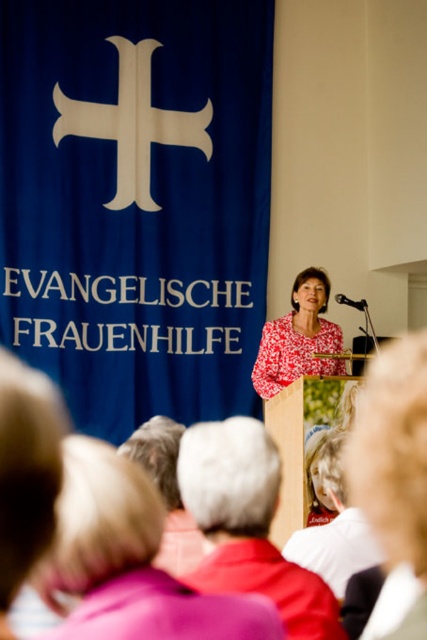
Between point (116, 157) and point (395, 540), which one is positioned in front?

Point (395, 540)

Between blue fabric banner at upper left and blonde hair at center, which one has more height?

blonde hair at center

In order to click on blue fabric banner at upper left in this screenshot , I will do `click(136, 202)`.

Image resolution: width=427 pixels, height=640 pixels. What are the coordinates of `blue fabric banner at upper left` in the screenshot? It's located at (136, 202).

Is point (257, 529) farther from camera compared to point (394, 380)?

Yes, it is.

Is white hair at center positioned in front of blonde hair at center?

No.

Is point (289, 609) positioned in front of point (391, 444)?

No.

Locate an element on the screen. The image size is (427, 640). white hair at center is located at coordinates (248, 524).

Can you confirm if blue fabric banner at upper left is bigger than white hair at center?

No, blue fabric banner at upper left is not bigger than white hair at center.

Does blue fabric banner at upper left appear on the left side of white hair at center?

Indeed, blue fabric banner at upper left is positioned on the left side of white hair at center.

Between point (119, 164) and point (210, 529), which one is positioned behind?

Point (119, 164)

I want to click on blue fabric banner at upper left, so click(136, 202).